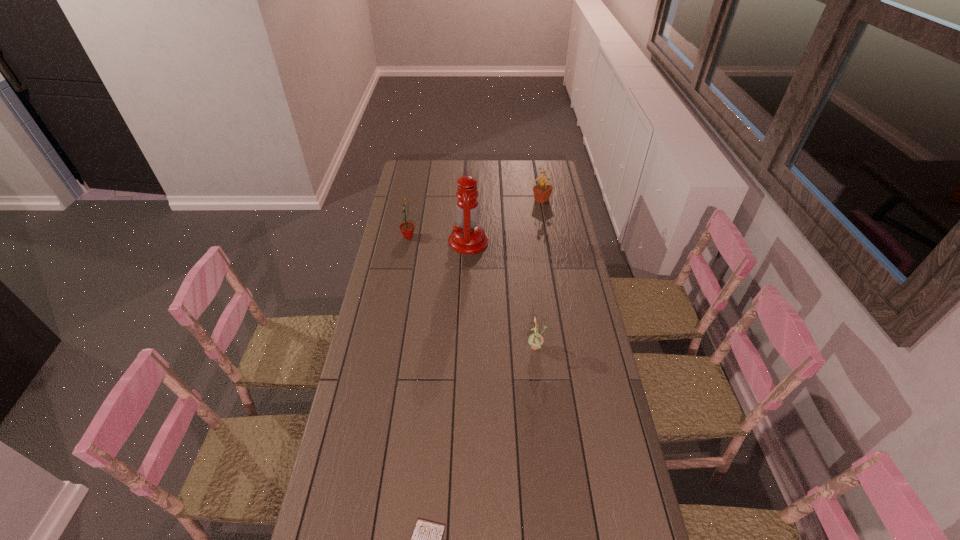
Find the location of `free space located at the front of the farthest sunflower with flowers visible`. free space located at the front of the farthest sunflower with flowers visible is located at coordinates (497, 200).

Find the location of a particular element. The image size is (960, 540). vacant space located 0.210m at the front of the farthest sunflower with flowers visible is located at coordinates (492, 200).

Find the location of a particular element. The image size is (960, 540). vacant space located 0.390m on the front-facing side of the shortest sunflower is located at coordinates (420, 348).

I want to click on free space located 0.200m on the front-facing side of the shortest sunflower, so click(472, 348).

Where is `vacant area located on the front-facing side of the shortest sunflower`? vacant area located on the front-facing side of the shortest sunflower is located at coordinates (486, 348).

Identify the location of object that is at the left edge. (407, 228).

You are a GUI agent. You are given a task and a screenshot of the screen. Output one action in this format:
    pyautogui.click(x=<x>, y=<y>)
    Task: Click on the object positioned at the right edge
    The image size is (960, 540).
    Given the screenshot: What is the action you would take?
    pyautogui.click(x=542, y=191)

At what (x,y) coordinates should I click in order to perform the action: click on vacant space at the left edge of the desktop. Please return your answer as a coordinate pair (x, y). The image size is (960, 540). Looking at the image, I should click on (363, 367).

Identify the location of vacant space at the right edge of the desktop. This screenshot has height=540, width=960. (591, 328).

Identify the location of blank space at the far left corner of the desktop. (417, 181).